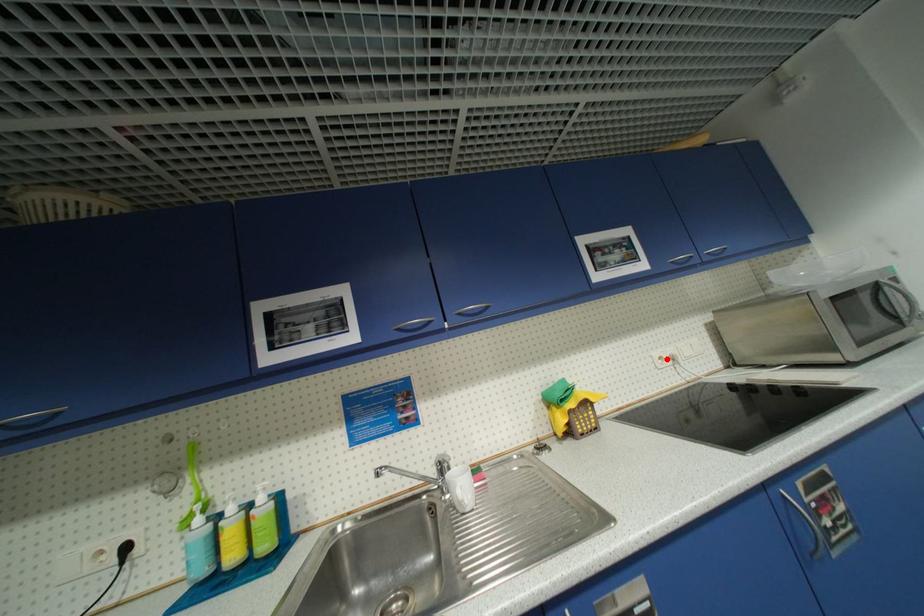
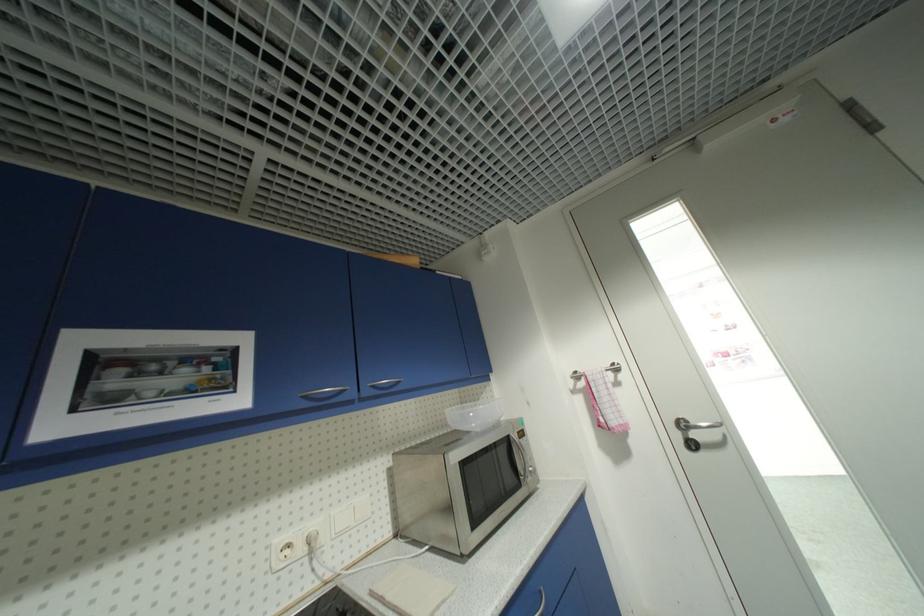
Question: I am providing you with two images of the same scene from different viewpoints. A red point is marked on the first image. Can you still see the location of the red point in image 2?

Choices:
 (A) Yes
 (B) No

Answer: (A)